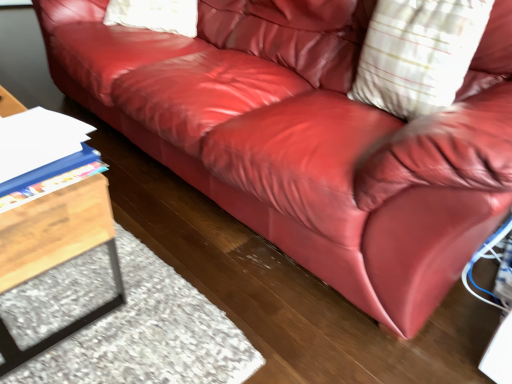
Question: From a real-world perspective, is white striped pillow at upper right below blue plastic folder at lower left?

Choices:
 (A) yes
 (B) no

Answer: (B)

Question: From a real-world perspective, does white striped pillow at upper right stand above blue plastic folder at lower left?

Choices:
 (A) no
 (B) yes

Answer: (B)

Question: Is white striped pillow at upper right next to blue plastic folder at lower left and touching it?

Choices:
 (A) yes
 (B) no

Answer: (B)

Question: Is the position of white striped pillow at upper right less distant than that of blue plastic folder at lower left?

Choices:
 (A) yes
 (B) no

Answer: (B)

Question: Is white striped pillow at upper right to the left of blue plastic folder at lower left from the viewer's perspective?

Choices:
 (A) yes
 (B) no

Answer: (B)

Question: From a real-world perspective, is wooden table at left positioned above or below blue plastic folder at lower left?

Choices:
 (A) above
 (B) below

Answer: (B)

Question: Considering the positions of wooden table at left and blue plastic folder at lower left in the image, is wooden table at left taller or shorter than blue plastic folder at lower left?

Choices:
 (A) tall
 (B) short

Answer: (A)

Question: From the image's perspective, is wooden table at left above or below blue plastic folder at lower left?

Choices:
 (A) below
 (B) above

Answer: (A)

Question: Which is correct: wooden table at left is inside blue plastic folder at lower left, or outside of it?

Choices:
 (A) inside
 (B) outside

Answer: (B)

Question: From the image's perspective, is white striped pillow at upper right located above or below wooden table at left?

Choices:
 (A) below
 (B) above

Answer: (B)

Question: From a real-world perspective, is white striped pillow at upper right positioned above or below wooden table at left?

Choices:
 (A) below
 (B) above

Answer: (B)

Question: Does point (388, 62) appear closer or farther from the camera than point (36, 228)?

Choices:
 (A) closer
 (B) farther

Answer: (B)

Question: Considering the positions of white striped pillow at upper right and wooden table at left in the image, is white striped pillow at upper right bigger or smaller than wooden table at left?

Choices:
 (A) small
 (B) big

Answer: (A)

Question: Considering the positions of blue plastic folder at lower left and wooden table at left in the image, is blue plastic folder at lower left bigger or smaller than wooden table at left?

Choices:
 (A) small
 (B) big

Answer: (A)

Question: Visually, is blue plastic folder at lower left positioned to the left or to the right of wooden table at left?

Choices:
 (A) left
 (B) right

Answer: (B)